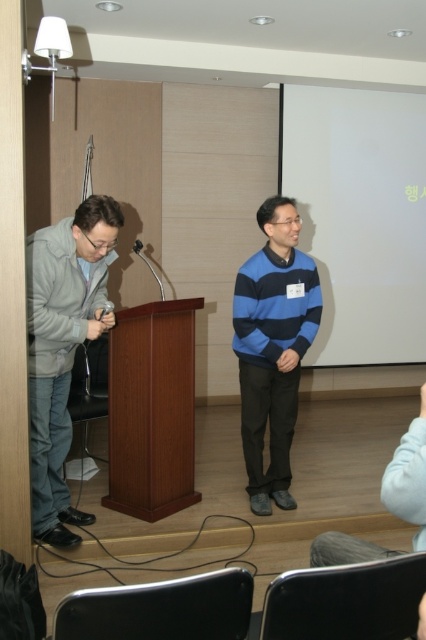
You are standing in the conference room and want to reach the podium. The podium is located at point (293, 257). If you are currently 3.05 meters away from this point, how many steps would you need to take to reach the podium, assuming each step covers approximately 0.76 meters?

To reach the podium located at point (293, 257), which is 3.05 meters away, you would need approximately 4 steps. This is calculated by dividing the total distance of 3.05 meters by the step length of 0.76 meters, resulting in approximately 4 steps.

You are standing at the entrance of the conference room and see two points marked in the scene. The first point is at coordinates point (66,365) and the second is at point (285,444). Which point is closer to you?

Point (66,365) is in front of point (285,444), so it is closer to you.